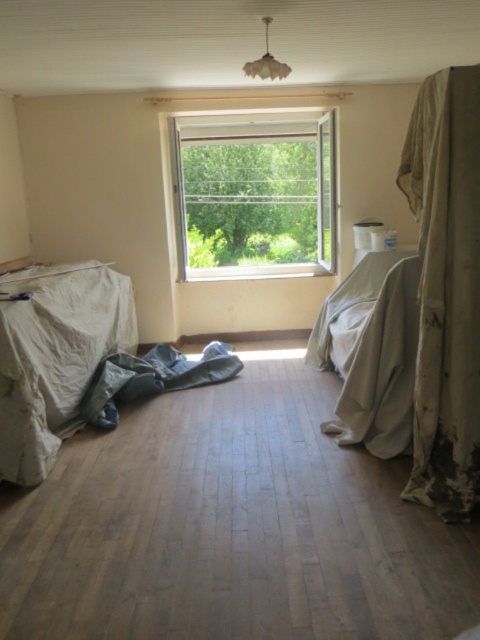
In the scene shown: Does clear glass window at center have a greater height compared to white fabric bed at center?

Yes.

What do you see at coordinates (253, 196) in the screenshot? I see `clear glass window at center` at bounding box center [253, 196].

You are a GUI agent. You are given a task and a screenshot of the screen. Output one action in this format:
    pyautogui.click(x=<x>, y=<y>)
    Task: Click on the clear glass window at center
    Image resolution: width=480 pixels, height=640 pixels.
    Given the screenshot: What is the action you would take?
    pyautogui.click(x=253, y=196)

Between worn fabric curtain at right and white fabric bed at center, which one appears on the right side from the viewer's perspective?

worn fabric curtain at right is more to the right.

Can you confirm if worn fabric curtain at right is smaller than white fabric bed at center?

Correct, worn fabric curtain at right occupies less space than white fabric bed at center.

Does point (427, 262) lie in front of point (336, 429)?

Yes.

What are the coordinates of `worn fabric curtain at right` in the screenshot? It's located at (445, 289).

Is point (403, 164) closer to camera compared to point (220, 273)?

Yes.

Is worn fabric curtain at right wider than clear glass window at center?

In fact, worn fabric curtain at right might be narrower than clear glass window at center.

Does point (422, 490) come in front of point (178, 253)?

Yes, it is.

Image resolution: width=480 pixels, height=640 pixels. I want to click on worn fabric curtain at right, so click(445, 289).